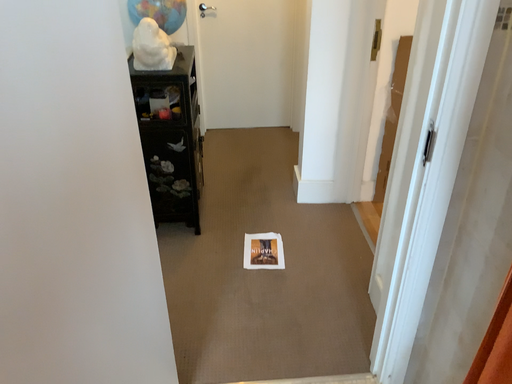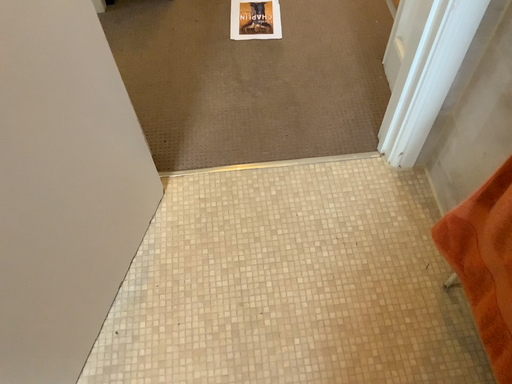
Question: How did the camera likely rotate when shooting the video?

Choices:
 (A) rotated upward
 (B) rotated downward

Answer: (B)